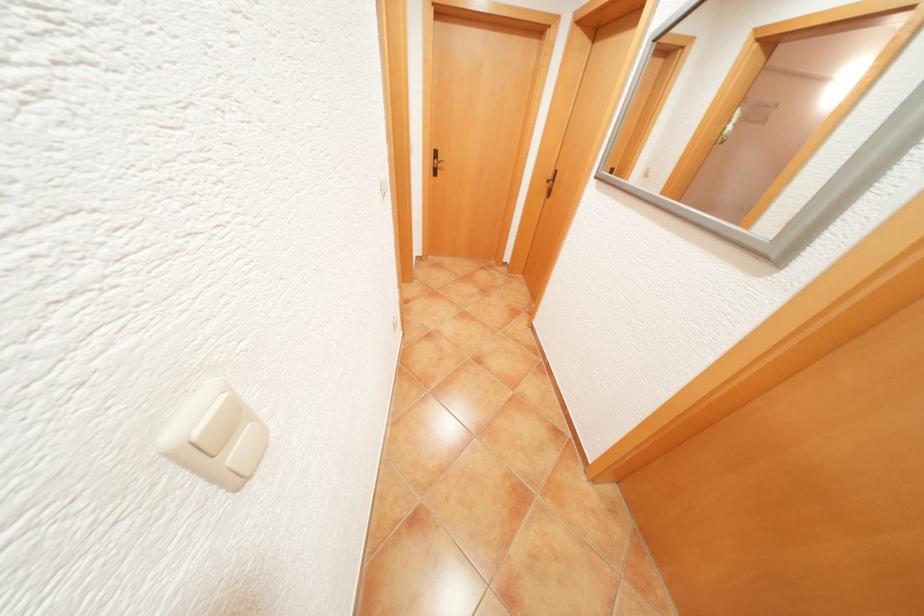
Find the location of a particular element. The width and height of the screenshot is (924, 616). light switch rocker is located at coordinates (215, 437).